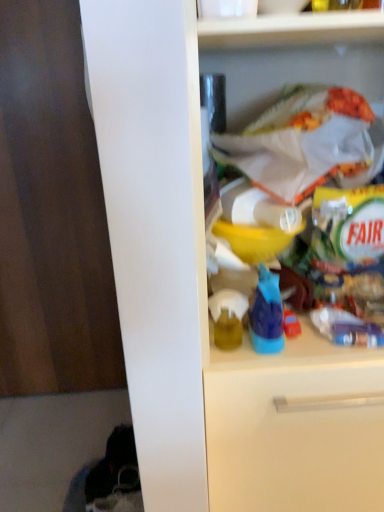
Question: Considering the relative sizes of blue plastic bottle at center and white plastic bag at upper right in the image provided, is blue plastic bottle at center thinner than white plastic bag at upper right?

Choices:
 (A) yes
 (B) no

Answer: (A)

Question: Does blue plastic bottle at center turn towards white plastic bag at upper right?

Choices:
 (A) yes
 (B) no

Answer: (B)

Question: Is blue plastic bottle at center behind white plastic bag at upper right?

Choices:
 (A) no
 (B) yes

Answer: (B)

Question: Considering the relative positions of blue plastic bottle at center and white plastic bag at upper right in the image provided, is blue plastic bottle at center to the right of white plastic bag at upper right from the viewer's perspective?

Choices:
 (A) yes
 (B) no

Answer: (B)

Question: Is blue plastic bottle at center not within white plastic bag at upper right?

Choices:
 (A) yes
 (B) no

Answer: (A)

Question: Does blue plastic bottle at center have a greater width compared to white plastic bag at upper right?

Choices:
 (A) yes
 (B) no

Answer: (B)

Question: Is the position of matte yellow bottle at center less distant than that of white plastic bag at upper right?

Choices:
 (A) no
 (B) yes

Answer: (A)

Question: Does matte yellow bottle at center have a greater width compared to white plastic bag at upper right?

Choices:
 (A) yes
 (B) no

Answer: (B)

Question: Does matte yellow bottle at center have a lesser width compared to white plastic bag at upper right?

Choices:
 (A) yes
 (B) no

Answer: (A)

Question: Does matte yellow bottle at center have a larger size compared to white plastic bag at upper right?

Choices:
 (A) yes
 (B) no

Answer: (B)

Question: Considering the relative sizes of matte yellow bottle at center and white plastic bag at upper right in the image provided, is matte yellow bottle at center shorter than white plastic bag at upper right?

Choices:
 (A) no
 (B) yes

Answer: (B)

Question: Is matte yellow bottle at center next to white plastic bag at upper right and touching it?

Choices:
 (A) no
 (B) yes

Answer: (A)

Question: Is blue plastic bottle at center aimed at dark wood door at left?

Choices:
 (A) yes
 (B) no

Answer: (B)